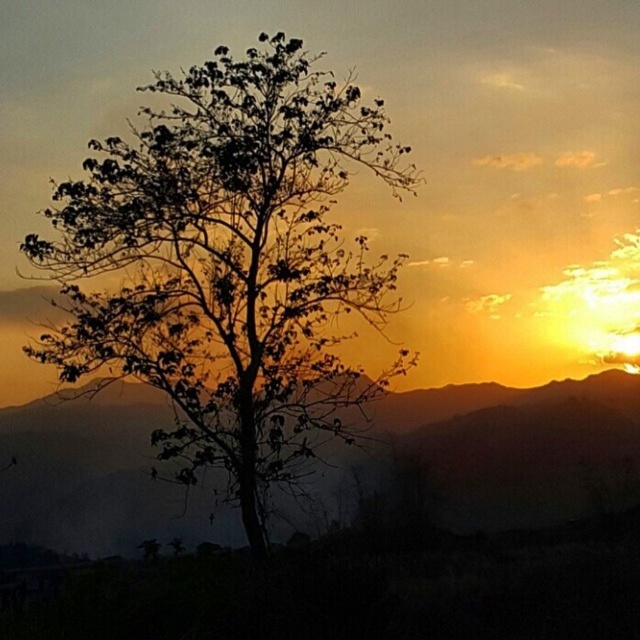
Where is `silhouette leafy tree at center`? The height and width of the screenshot is (640, 640). silhouette leafy tree at center is located at coordinates (228, 264).

Is point (291, 442) closer to viewer compared to point (573, 388)?

Yes, it is in front of point (573, 388).

Locate an element on the screen. silhouette leafy tree at center is located at coordinates (228, 264).